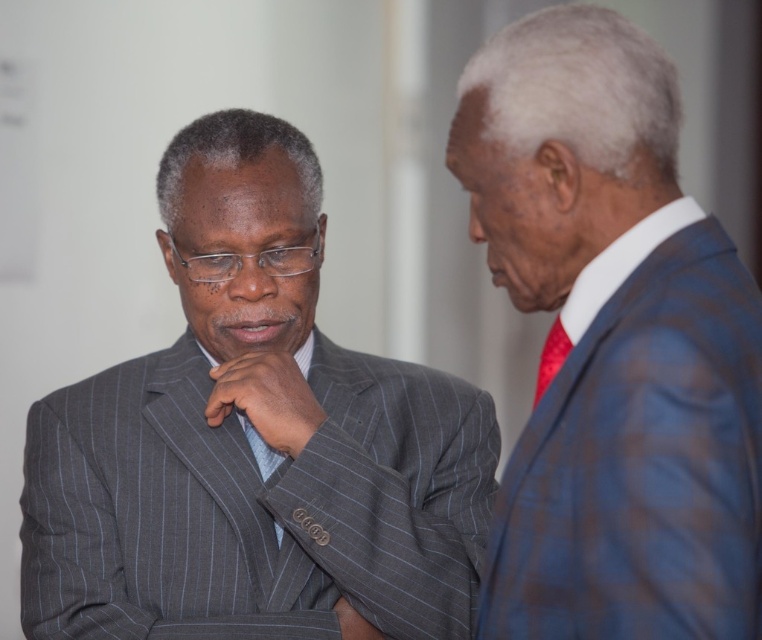
Question: Is blue plaid suit at right further to camera compared to matte gray suit at left?

Choices:
 (A) yes
 (B) no

Answer: (B)

Question: Based on their relative distances, which object is nearer to the red satin tie at right?

Choices:
 (A) blue plaid suit at right
 (B) matte gray suit at left

Answer: (A)

Question: Can you confirm if gray pinstripe suit at center is wider than red satin tie at right?

Choices:
 (A) no
 (B) yes

Answer: (B)

Question: Considering the real-world distances, which object is farthest from the matte gray suit at left?

Choices:
 (A) blue plaid suit at right
 (B) red satin tie at right

Answer: (A)

Question: Which point is closer to the camera taking this photo?

Choices:
 (A) (552, 348)
 (B) (602, 296)
 (C) (239, 333)
 (D) (283, 472)

Answer: (B)

Question: Does gray pinstripe suit at center come behind matte gray suit at left?

Choices:
 (A) yes
 (B) no

Answer: (B)